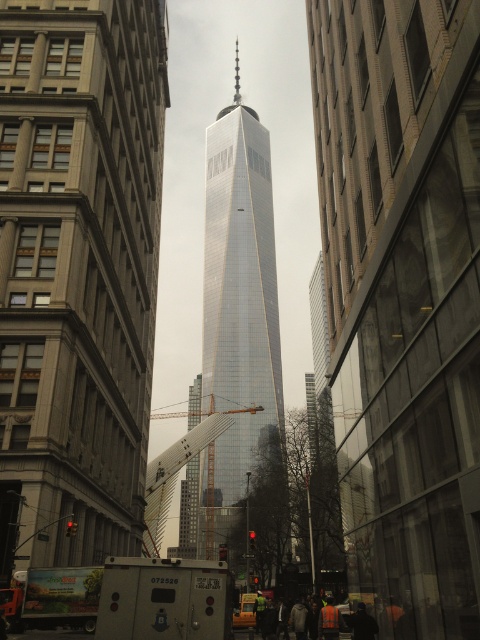
Looking at this image, you are standing on the street and want to take a photo of the glassy reflective skyscraper at center. Based on its position, where should you stand to capture it in the frame?

The glassy reflective skyscraper at center is located at point (78, 273), so you should position yourself at that coordinate to ensure it is centered in your photo.

You are a construction worker standing on the sidewalk near the shiny glass skyscraper at center and the metallic silver crane at center. Which object is closer to you?

The shiny glass skyscraper at center is closer to you because it is positioned in front of the metallic silver crane at center, making the crane appear behind it from your perspective.